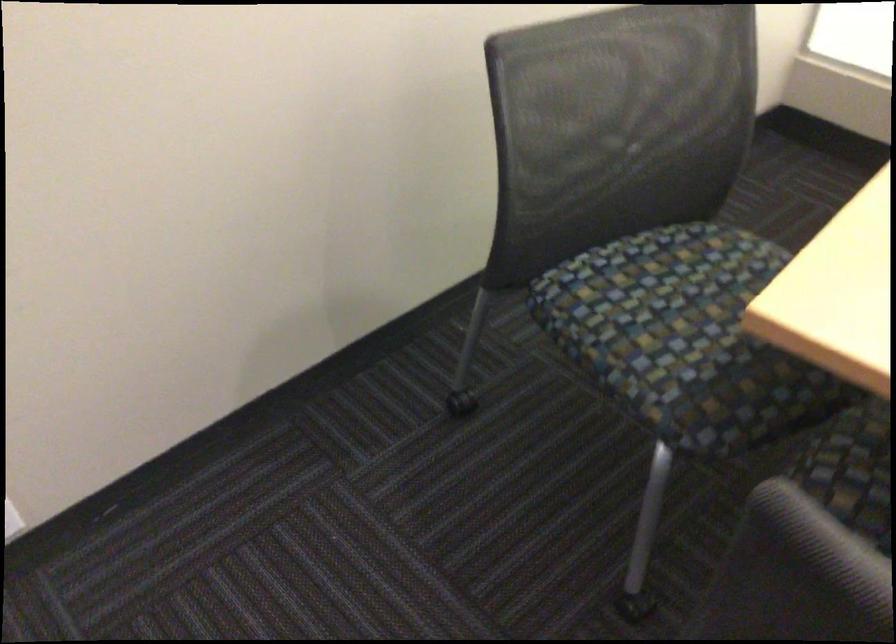
Where would you rest the chair armrest? Please return your answer as a coordinate pair (x, y).

(851, 469)